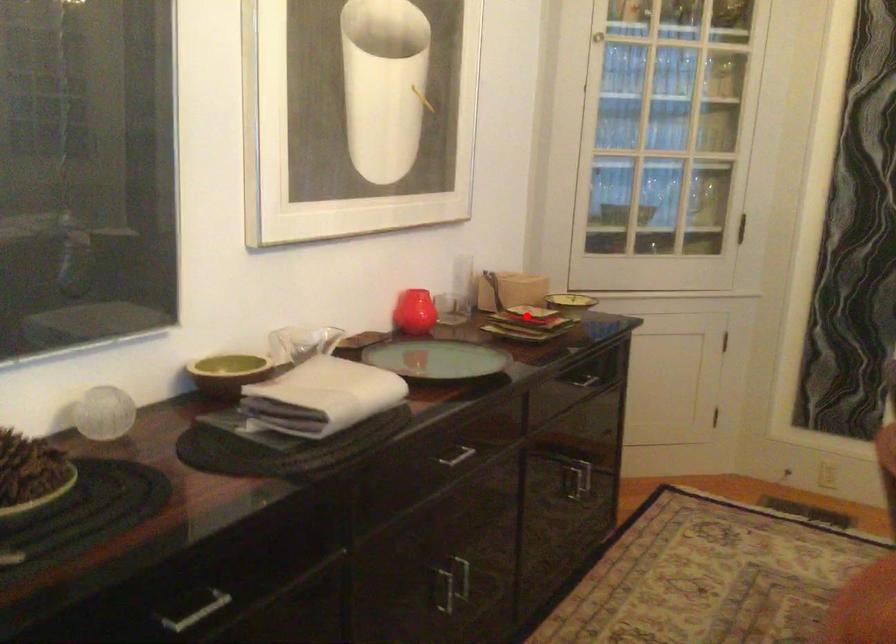
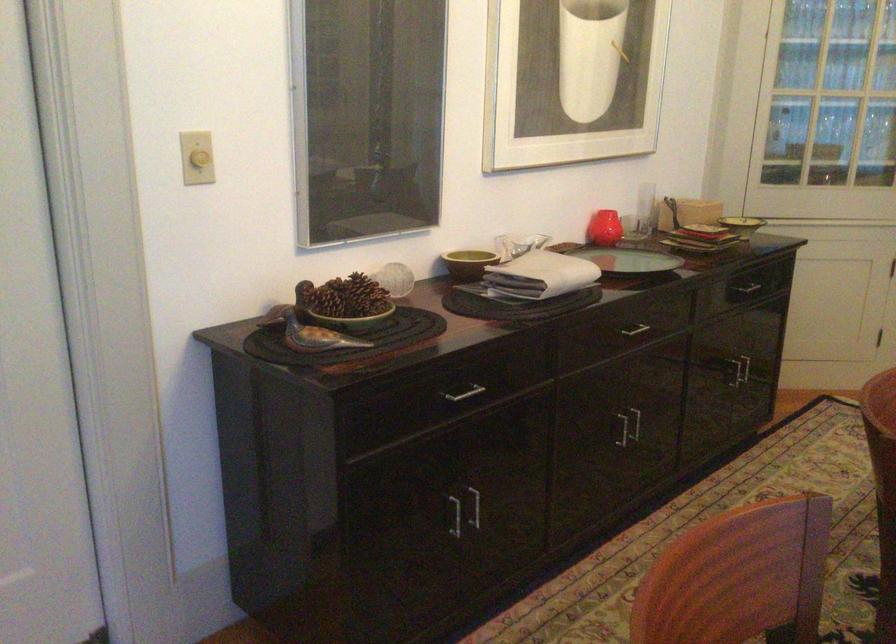
Question: I am providing you with two images of the same scene from different viewpoints. A red point is shown in image1. For the corresponding object point in image2, is it positioned nearer or farther from the camera?

Choices:
 (A) Nearer
 (B) Farther

Answer: (B)